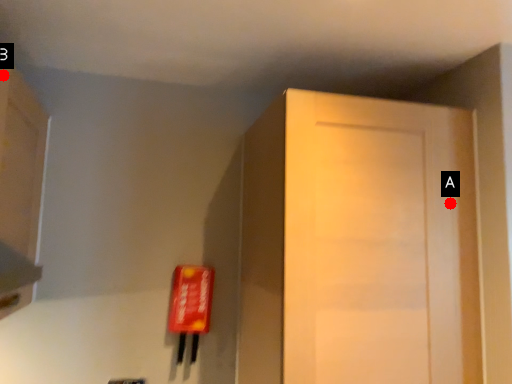
Question: Two points are circled on the image, labeled by A and B beside each circle. Which point is closer to the camera?

Choices:
 (A) A is closer
 (B) B is closer

Answer: (B)